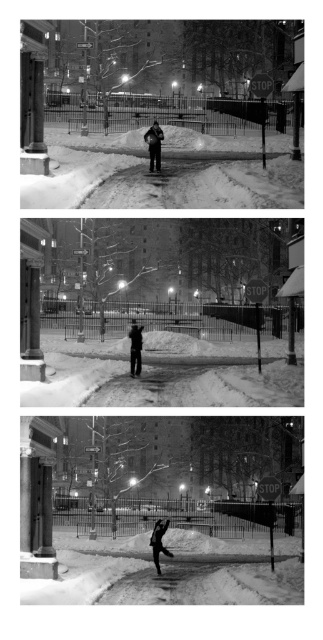
Does point (154, 529) come closer to viewer compared to point (129, 372)?

Yes, it is.

Between point (156, 538) and point (134, 348), which one is positioned behind?

The point (134, 348) is behind.

Does point (157, 556) come closer to viewer compared to point (135, 360)?

That is True.

Locate an element on the screen. This screenshot has height=640, width=323. black matte snowboarder at center is located at coordinates (158, 541).

Can you confirm if dark gray jacket at center is positioned above dark gray fabric jacket at center?

Yes, dark gray jacket at center is above dark gray fabric jacket at center.

Who is positioned more to the left, dark gray jacket at center or dark gray fabric jacket at center?

dark gray fabric jacket at center is more to the left.

The height and width of the screenshot is (640, 323). I want to click on dark gray jacket at center, so coord(154,145).

Is point (152, 156) in front of point (153, 536)?

No, it is not.

This screenshot has width=323, height=640. What do you see at coordinates (154, 145) in the screenshot? I see `dark gray jacket at center` at bounding box center [154, 145].

Locate an element on the screen. Image resolution: width=323 pixels, height=640 pixels. dark gray jacket at center is located at coordinates (154, 145).